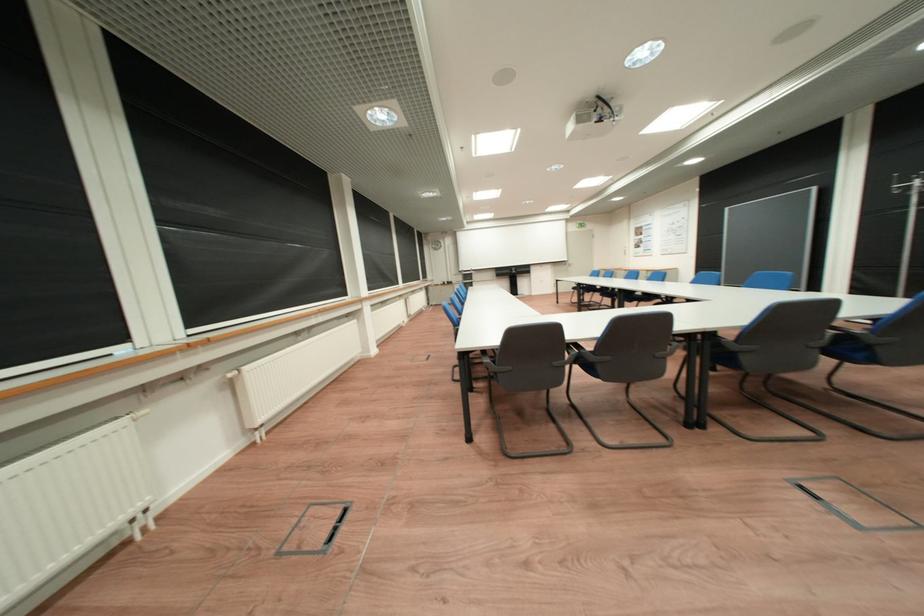
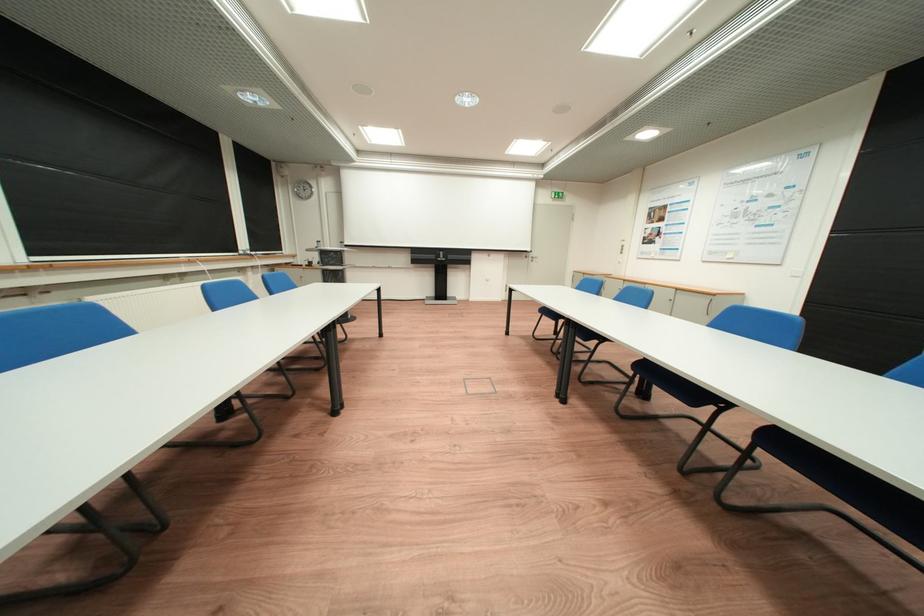
The point at (521,273) is marked in the first image. Where is the corresponding point in the second image?

(445, 257)